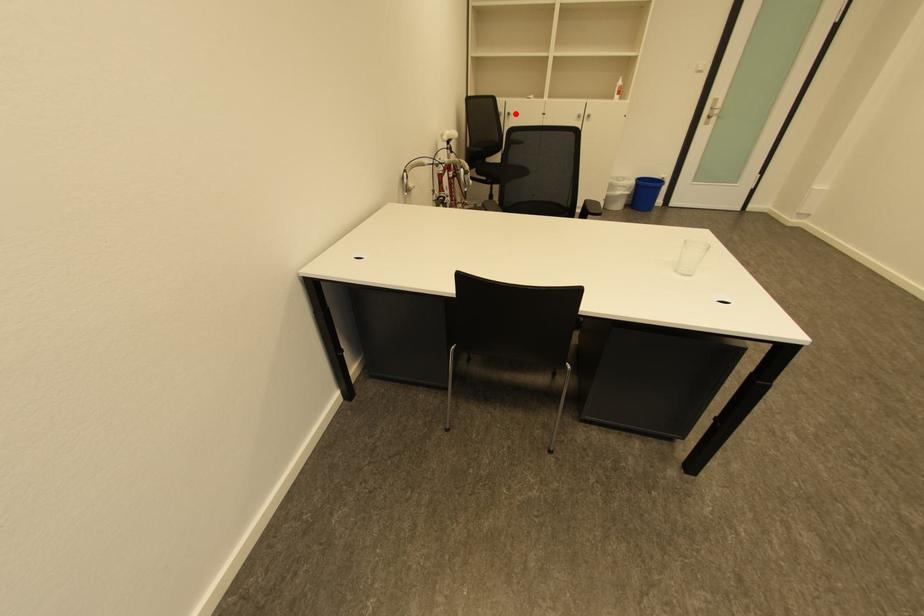
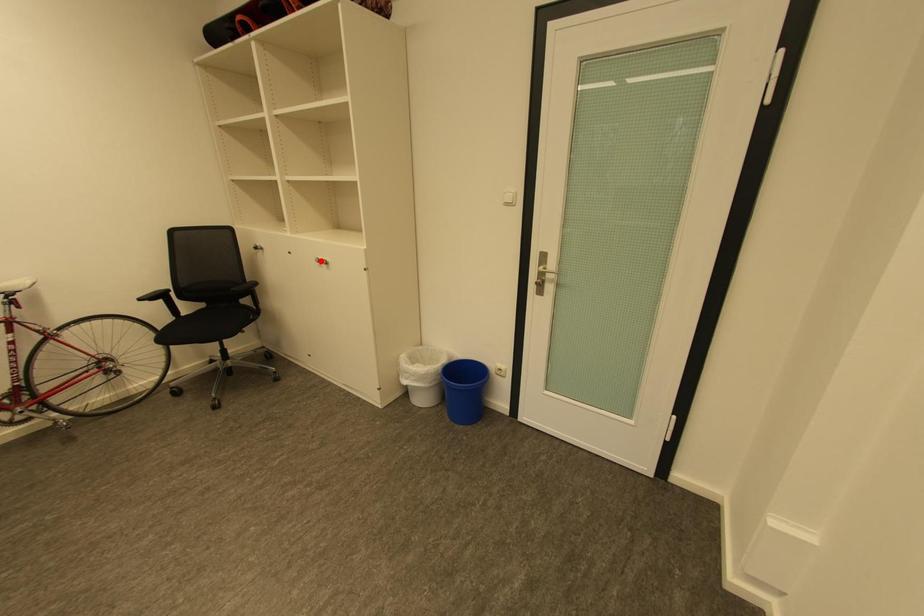
I am providing you with two images of the same scene from different viewpoints. A red point is marked on the first image and another point is marked on the second image. Does the point marked in image1 correspond to the same location as the one in image2?

No